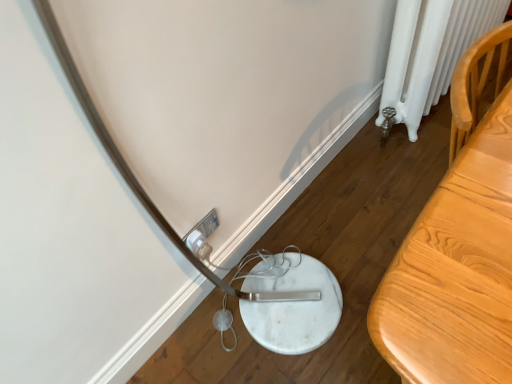
You are a GUI agent. You are given a task and a screenshot of the screen. Output one action in this format:
    pyautogui.click(x=<x>, y=<y>)
    Task: Click on the vacant space behind light wood table at right
    The height and width of the screenshot is (384, 512).
    Given the screenshot: What is the action you would take?
    tap(387, 190)